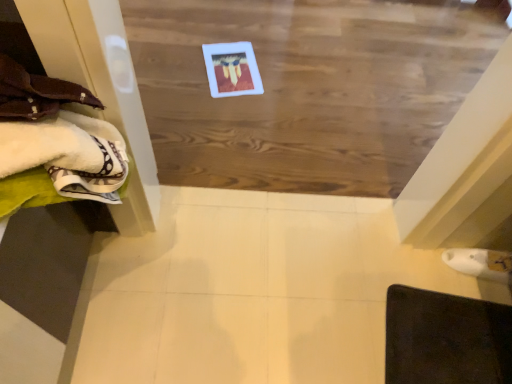
The height and width of the screenshot is (384, 512). I want to click on free spot above wooden board at center (from a real-world perspective), so click(x=249, y=75).